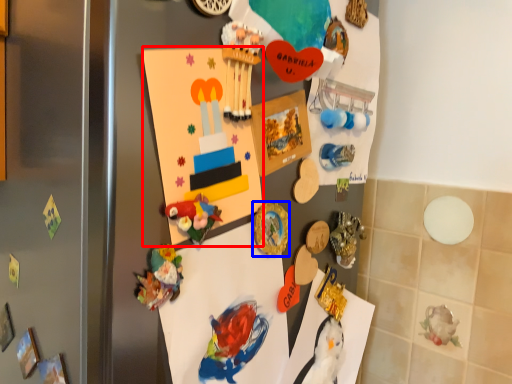
Question: Which of the following is the farthest to the observer, postcard (highlighted by a red box) or button (highlighted by a blue box)?

Choices:
 (A) postcard
 (B) button

Answer: (B)